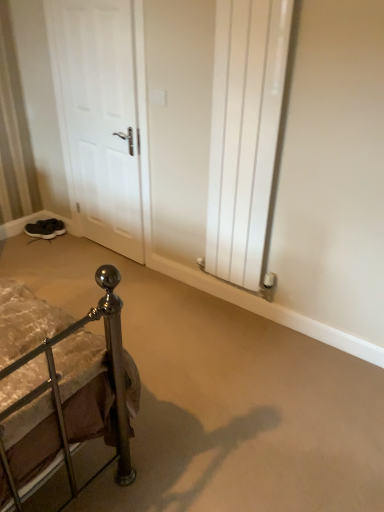
How much space does black suede shoes at lower left, the 2th footwear in the front-to-back sequence, occupy vertically?

The height of black suede shoes at lower left, the 2th footwear in the front-to-back sequence, is 12.81 centimeters.

Where is `white glossy radiator at center right`? white glossy radiator at center right is located at coordinates (246, 133).

What do you see at coordinates (99, 117) in the screenshot?
I see `white matte door at left` at bounding box center [99, 117].

What is the approximate width of white matte door at left?

It is 4.63 inches.

Identify the location of dark gray suede sneakers at lower left, which appears as the 2th footwear when viewed from the back. Image resolution: width=384 pixels, height=512 pixels. (41, 229).

Between white glossy radiator at center right and dark gray suede sneakers at lower left, which appears as the 2th footwear when viewed from the back, which one appears on the left side from the viewer's perspective?

From the viewer's perspective, dark gray suede sneakers at lower left, which appears as the 2th footwear when viewed from the back, appears more on the left side.

Is dark gray suede sneakers at lower left, the 1th footwear in the front-to-back sequence, located within white glossy radiator at center right?

No, dark gray suede sneakers at lower left, the 1th footwear in the front-to-back sequence, is not surrounded by white glossy radiator at center right.

Is point (258, 219) positioned after point (41, 229)?

No, it is not.

Based on the photo, is black suede shoes at lower left, the 2th footwear in the front-to-back sequence, in front of white glossy radiator at center right?

No, the depth of black suede shoes at lower left, the 2th footwear in the front-to-back sequence, is greater than that of white glossy radiator at center right.

Does black suede shoes at lower left, which is the first footwear from back to front, contain white glossy radiator at center right?

No, white glossy radiator at center right is not inside black suede shoes at lower left, which is the first footwear from back to front.

Is black suede shoes at lower left, which is the first footwear from back to front, far from white glossy radiator at center right?

Indeed, black suede shoes at lower left, which is the first footwear from back to front, is not near white glossy radiator at center right.

Can you confirm if black suede shoes at lower left, which is the first footwear from back to front, is smaller than white glossy radiator at center right?

Indeed, black suede shoes at lower left, which is the first footwear from back to front, has a smaller size compared to white glossy radiator at center right.

Measure the distance from white glossy radiator at center right to black suede shoes at lower left, the 2th footwear in the front-to-back sequence.

white glossy radiator at center right and black suede shoes at lower left, the 2th footwear in the front-to-back sequence, are 1.82 meters apart.

Considering the relative sizes of white glossy radiator at center right and black suede shoes at lower left, which is the first footwear from back to front, in the image provided, is white glossy radiator at center right thinner than black suede shoes at lower left, which is the first footwear from back to front,?

Yes.

Choose the correct answer: Is white glossy radiator at center right inside black suede shoes at lower left, the 2th footwear in the front-to-back sequence, or outside it?

white glossy radiator at center right is not enclosed by black suede shoes at lower left, the 2th footwear in the front-to-back sequence.

Based on the photo, can you confirm if white glossy radiator at center right is bigger than black suede shoes at lower left, which is the first footwear from back to front?

Yes.

Considering the sizes of dark gray suede sneakers at lower left, the 1th footwear in the front-to-back sequence, and white matte door at left in the image, is dark gray suede sneakers at lower left, the 1th footwear in the front-to-back sequence, bigger or smaller than white matte door at left?

dark gray suede sneakers at lower left, the 1th footwear in the front-to-back sequence, is smaller than white matte door at left.

Between dark gray suede sneakers at lower left, the 1th footwear in the front-to-back sequence, and white matte door at left, which one is positioned in front?

white matte door at left is in front.

Looking at this image, from the image's perspective, would you say dark gray suede sneakers at lower left, which appears as the 2th footwear when viewed from the back, is positioned over white matte door at left?

No, from the image's perspective, dark gray suede sneakers at lower left, which appears as the 2th footwear when viewed from the back, is not above white matte door at left.

Would you consider dark gray suede sneakers at lower left, which appears as the 2th footwear when viewed from the back, to be distant from black suede shoes at lower left, the 2th footwear in the front-to-back sequence?

dark gray suede sneakers at lower left, which appears as the 2th footwear when viewed from the back, is actually quite close to black suede shoes at lower left, the 2th footwear in the front-to-back sequence.

Considering the relative positions of dark gray suede sneakers at lower left, which appears as the 2th footwear when viewed from the back, and black suede shoes at lower left, the 2th footwear in the front-to-back sequence, in the image provided, is dark gray suede sneakers at lower left, which appears as the 2th footwear when viewed from the back, to the left of black suede shoes at lower left, the 2th footwear in the front-to-back sequence, from the viewer's perspective?

Correct, you'll find dark gray suede sneakers at lower left, which appears as the 2th footwear when viewed from the back, to the left of black suede shoes at lower left, the 2th footwear in the front-to-back sequence.

Is dark gray suede sneakers at lower left, the 1th footwear in the front-to-back sequence, taller than black suede shoes at lower left, the 2th footwear in the front-to-back sequence?

In fact, dark gray suede sneakers at lower left, the 1th footwear in the front-to-back sequence, may be shorter than black suede shoes at lower left, the 2th footwear in the front-to-back sequence.

Is white matte door at left aimed at white glossy radiator at center right?

No, white matte door at left is not turned towards white glossy radiator at center right.

Considering the relative positions of white matte door at left and white glossy radiator at center right in the image provided, is white matte door at left to the right of white glossy radiator at center right from the viewer's perspective?

No.

Considering the sizes of objects white matte door at left and white glossy radiator at center right in the image provided, who is wider, white matte door at left or white glossy radiator at center right?

With larger width is white matte door at left.

Considering the sizes of objects white matte door at left and white glossy radiator at center right in the image provided, who is taller, white matte door at left or white glossy radiator at center right?

white matte door at left is taller.

Is dark gray suede sneakers at lower left, which appears as the 2th footwear when viewed from the back, completely or partially outside of white glossy radiator at center right?

Absolutely, dark gray suede sneakers at lower left, which appears as the 2th footwear when viewed from the back, is external to white glossy radiator at center right.

Does dark gray suede sneakers at lower left, the 1th footwear in the front-to-back sequence, have a greater height compared to white glossy radiator at center right?

No, dark gray suede sneakers at lower left, the 1th footwear in the front-to-back sequence, is not taller than white glossy radiator at center right.

Is dark gray suede sneakers at lower left, the 1th footwear in the front-to-back sequence, in front of or behind white glossy radiator at center right in the image?

In the image, dark gray suede sneakers at lower left, the 1th footwear in the front-to-back sequence, appears behind white glossy radiator at center right.

This screenshot has height=512, width=384. Identify the location of the 1st footwear behind the white glossy radiator at center right. (41, 229).

You are a GUI agent. You are given a task and a screenshot of the screen. Output one action in this format:
    pyautogui.click(x=<x>, y=<y>)
    Task: Click on the 1st footwear below the white glossy radiator at center right (from the image's perspective)
    
    Given the screenshot: What is the action you would take?
    pyautogui.click(x=51, y=227)

Which object lies further to the anchor point dark gray suede sneakers at lower left, the 1th footwear in the front-to-back sequence, black suede shoes at lower left, which is the first footwear from back to front, or white glossy radiator at center right?

Among the two, white glossy radiator at center right is located further to dark gray suede sneakers at lower left, the 1th footwear in the front-to-back sequence.

Based on their spatial positions, is white matte door at left or dark gray suede sneakers at lower left, which appears as the 2th footwear when viewed from the back, closer to white glossy radiator at center right?

white matte door at left is closer to white glossy radiator at center right.

Considering their positions, is black suede shoes at lower left, the 2th footwear in the front-to-back sequence, positioned closer to white matte door at left than dark gray suede sneakers at lower left, the 1th footwear in the front-to-back sequence?

Based on the image, black suede shoes at lower left, the 2th footwear in the front-to-back sequence, appears to be nearer to white matte door at left.

Looking at the image, which one is located closer to white matte door at left, dark gray suede sneakers at lower left, the 1th footwear in the front-to-back sequence, or black suede shoes at lower left, the 2th footwear in the front-to-back sequence?

black suede shoes at lower left, the 2th footwear in the front-to-back sequence, lies closer to white matte door at left than the other object.

Which object lies further to the anchor point dark gray suede sneakers at lower left, the 1th footwear in the front-to-back sequence, white matte door at left or white glossy radiator at center right?

Based on the image, white glossy radiator at center right appears to be further to dark gray suede sneakers at lower left, the 1th footwear in the front-to-back sequence.

From the image, which object appears to be nearer to white matte door at left, white glossy radiator at center right or black suede shoes at lower left, which is the first footwear from back to front?

Among the two, white glossy radiator at center right is located nearer to white matte door at left.

Estimate the real-world distances between objects in this image. Which object is further from white matte door at left, dark gray suede sneakers at lower left, the 1th footwear in the front-to-back sequence, or white glossy radiator at center right?

Among the two, dark gray suede sneakers at lower left, the 1th footwear in the front-to-back sequence, is located further to white matte door at left.

In the scene shown: From the image, which object appears to be nearer to dark gray suede sneakers at lower left, which appears as the 2th footwear when viewed from the back, white glossy radiator at center right or black suede shoes at lower left, which is the first footwear from back to front?

black suede shoes at lower left, which is the first footwear from back to front, lies closer to dark gray suede sneakers at lower left, which appears as the 2th footwear when viewed from the back, than the other object.

Find the location of `door positioned between white glossy radiator at center right and dark gray suede sneakers at lower left, which appears as the 2th footwear when viewed from the back, from near to far`. door positioned between white glossy radiator at center right and dark gray suede sneakers at lower left, which appears as the 2th footwear when viewed from the back, from near to far is located at coordinates (99, 117).

Locate an element on the screen. The width and height of the screenshot is (384, 512). door between white glossy radiator at center right and black suede shoes at lower left, which is the first footwear from back to front, along the z-axis is located at coordinates (99, 117).

This screenshot has width=384, height=512. Find the location of `footwear positioned between white glossy radiator at center right and black suede shoes at lower left, which is the first footwear from back to front, from near to far`. footwear positioned between white glossy radiator at center right and black suede shoes at lower left, which is the first footwear from back to front, from near to far is located at coordinates (41, 229).

Where is `footwear between white matte door at left and black suede shoes at lower left, the 2th footwear in the front-to-back sequence, from front to back`? This screenshot has height=512, width=384. footwear between white matte door at left and black suede shoes at lower left, the 2th footwear in the front-to-back sequence, from front to back is located at coordinates (41, 229).